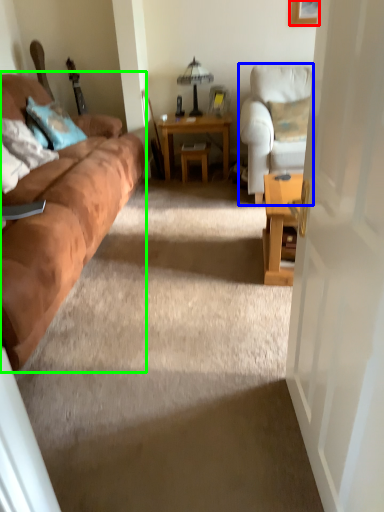
Question: Based on their relative distances, which object is nearer to picture frame (highlighted by a red box)? Choose from chair (highlighted by a blue box) and studio couch (highlighted by a green box).

Choices:
 (A) chair
 (B) studio couch

Answer: (A)